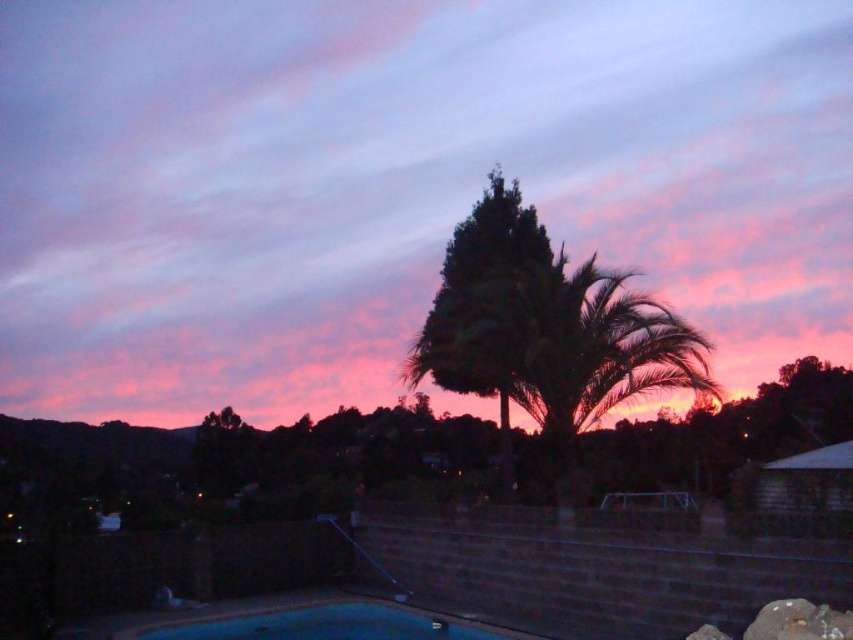
Describe the element at coordinates (544, 326) in the screenshot. I see `silhouette leafy palm at center` at that location.

Is silhouette leafy palm at center below blue smooth pool at lower center?

No.

Find the location of a particular element. silhouette leafy palm at center is located at coordinates (544, 326).

Is pink cotton candy cloud at upper center to the right of blue smooth pool at lower center from the viewer's perspective?

Incorrect, pink cotton candy cloud at upper center is not on the right side of blue smooth pool at lower center.

Does pink cotton candy cloud at upper center have a lesser height compared to blue smooth pool at lower center?

Incorrect, pink cotton candy cloud at upper center's height does not fall short of blue smooth pool at lower center's.

The image size is (853, 640). Describe the element at coordinates (397, 182) in the screenshot. I see `pink cotton candy cloud at upper center` at that location.

Where is `pink cotton candy cloud at upper center`? The height and width of the screenshot is (640, 853). pink cotton candy cloud at upper center is located at coordinates (397, 182).

Can you confirm if pink cotton candy cloud at upper center is thinner than silhouette leafy palm at center?

Incorrect, pink cotton candy cloud at upper center's width is not less than silhouette leafy palm at center's.

Who is positioned more to the left, pink cotton candy cloud at upper center or silhouette leafy palm at center?

Positioned to the left is pink cotton candy cloud at upper center.

Identify the location of pink cotton candy cloud at upper center. The image size is (853, 640). (397, 182).

Find the location of a particular element. This screenshot has width=853, height=640. pink cotton candy cloud at upper center is located at coordinates tap(397, 182).